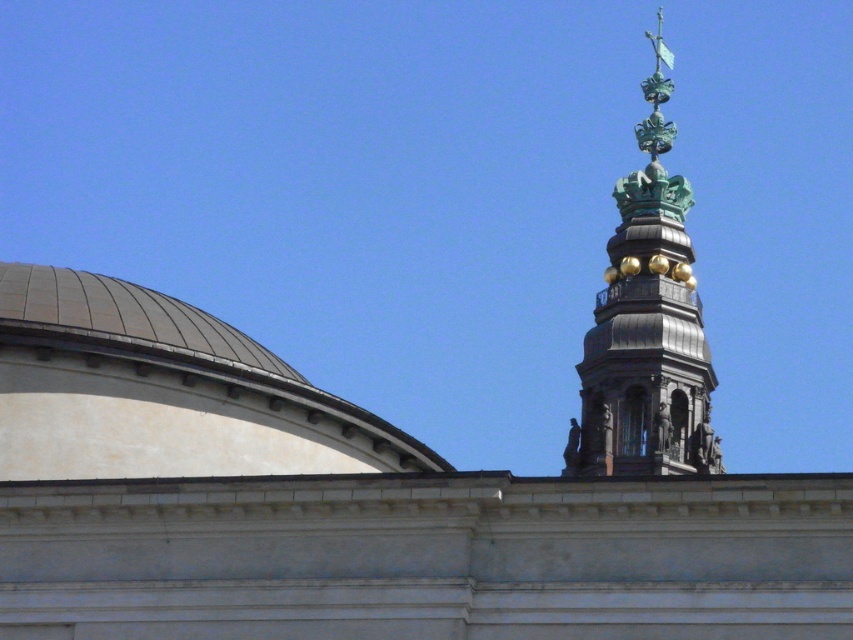
You are an architect analyzing the classical building. From your vantage point, which structure is located lower in the image, the smooth white dome at upper left or the green patina tower at upper right?

The smooth white dome at upper left is positioned under the green patina tower at upper right, so it is located lower in the image.

You are an architect planning to install a new lighting system between the smooth white dome at upper left and the green patina tower at upper right. The lighting system requires a minimum of 40 meters of cable to span the distance between them. Based on the scene description, will the available cable length be sufficient?

The distance between the smooth white dome at upper left and the green patina tower at upper right is 43.86 meters. Since the required minimum cable length is 40 meters, the available cable length of 43.86 meters is sufficient to cover the distance between them.